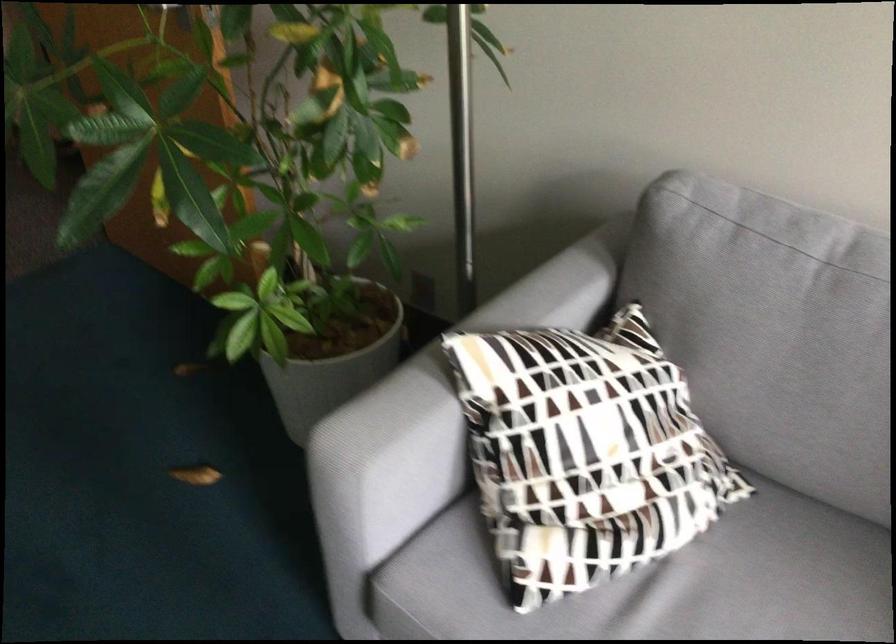
Where is `white plant pot`? white plant pot is located at coordinates (332, 355).